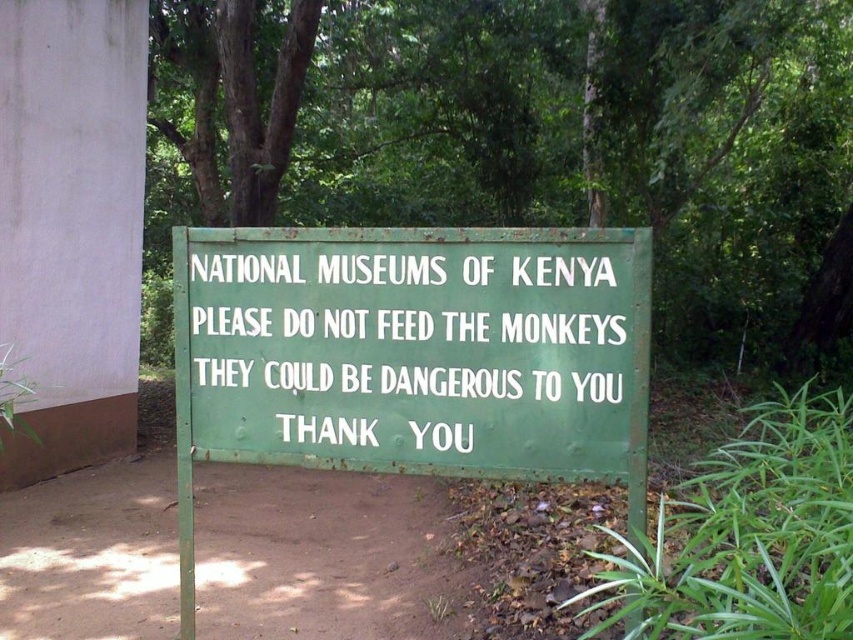
Does green wooden signboard at center have a smaller size compared to green painted metal signboard at center?

No, green wooden signboard at center is not smaller than green painted metal signboard at center.

Which is in front, point (354, 26) or point (206, 449)?

Positioned in front is point (206, 449).

Does point (622, 147) come behind point (483, 385)?

Yes, point (622, 147) is farther from viewer.

Image resolution: width=853 pixels, height=640 pixels. In order to click on green wooden signboard at center in this screenshot , I will do `click(730, 164)`.

Which is more to the right, green wooden signboard at center or green metal sign at center?

green wooden signboard at center

Is green wooden signboard at center taller than green metal sign at center?

Yes.

The width and height of the screenshot is (853, 640). Describe the element at coordinates (730, 164) in the screenshot. I see `green wooden signboard at center` at that location.

The image size is (853, 640). Identify the location of green wooden signboard at center. (730, 164).

Which is in front, point (456, 259) or point (543, 435)?

Positioned in front is point (543, 435).

Is green metal sign at center positioned in front of green painted metal signboard at center?

Yes, green metal sign at center is in front of green painted metal signboard at center.

Which is in front, point (387, 230) or point (444, 412)?

Point (387, 230) is in front.

The image size is (853, 640). Identify the location of green metal sign at center. (412, 355).